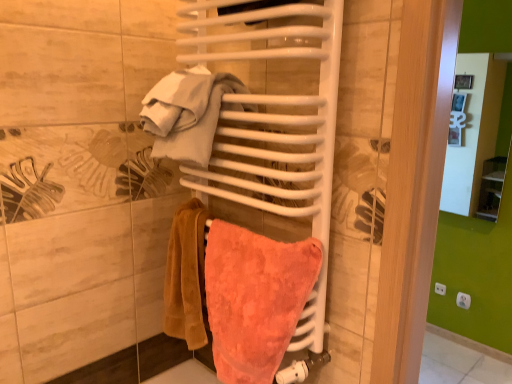
Question: Is white cotton towel at upper center wider than coral terry towel at center?

Choices:
 (A) yes
 (B) no

Answer: (A)

Question: Considering the relative sizes of white cotton towel at upper center and coral terry towel at center in the image provided, is white cotton towel at upper center smaller than coral terry towel at center?

Choices:
 (A) no
 (B) yes

Answer: (B)

Question: Can you confirm if white cotton towel at upper center is bigger than coral terry towel at center?

Choices:
 (A) yes
 (B) no

Answer: (B)

Question: Are white cotton towel at upper center and coral terry towel at center far apart?

Choices:
 (A) no
 (B) yes

Answer: (A)

Question: Can you confirm if white cotton towel at upper center is shorter than coral terry towel at center?

Choices:
 (A) no
 (B) yes

Answer: (B)

Question: Is white cotton towel at upper center behind coral terry towel at center?

Choices:
 (A) yes
 (B) no

Answer: (A)

Question: Can you confirm if coral terry towel at center is thinner than white cotton towel at upper center?

Choices:
 (A) yes
 (B) no

Answer: (A)

Question: Would you consider coral terry towel at center to be distant from white cotton towel at upper center?

Choices:
 (A) yes
 (B) no

Answer: (B)

Question: From the image's perspective, would you say coral terry towel at center is shown under white cotton towel at upper center?

Choices:
 (A) yes
 (B) no

Answer: (A)

Question: Is coral terry towel at center positioned beyond the bounds of white cotton towel at upper center?

Choices:
 (A) no
 (B) yes

Answer: (B)

Question: From a real-world perspective, is coral terry towel at center on white cotton towel at upper center?

Choices:
 (A) no
 (B) yes

Answer: (A)

Question: From a real-world perspective, is coral terry towel at center physically below white cotton towel at upper center?

Choices:
 (A) yes
 (B) no

Answer: (A)

Question: Is coral terry towel at center situated inside white cotton towel at upper center or outside?

Choices:
 (A) inside
 (B) outside

Answer: (B)